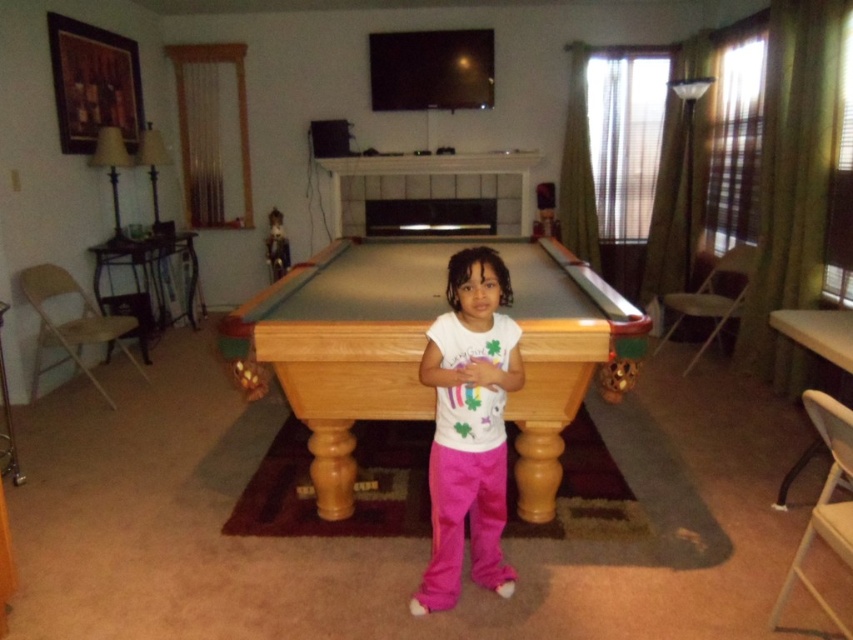
You are a photographer setting up a shoot in the recreational room. You want to ensure that the light brown wood pool table at center is visible in the background behind the white cotton shirt at center. Based on their positions, is this arrangement possible?

The light brown wood pool table at center is above the white cotton shirt at center, so yes, the photographer can position the white cotton shirt at center in front of the pool table to have it visible in the background.

Based on the photo, you are a photographer setting up a shoot in the recreational room. You need to ensure that the light brown wood pool table at center and the white cotton shirt at center are both in frame. Given their sizes, which object will require more space in the camera frame?

The light brown wood pool table at center is larger in size than the white cotton shirt at center, so it will require more space in the camera frame.